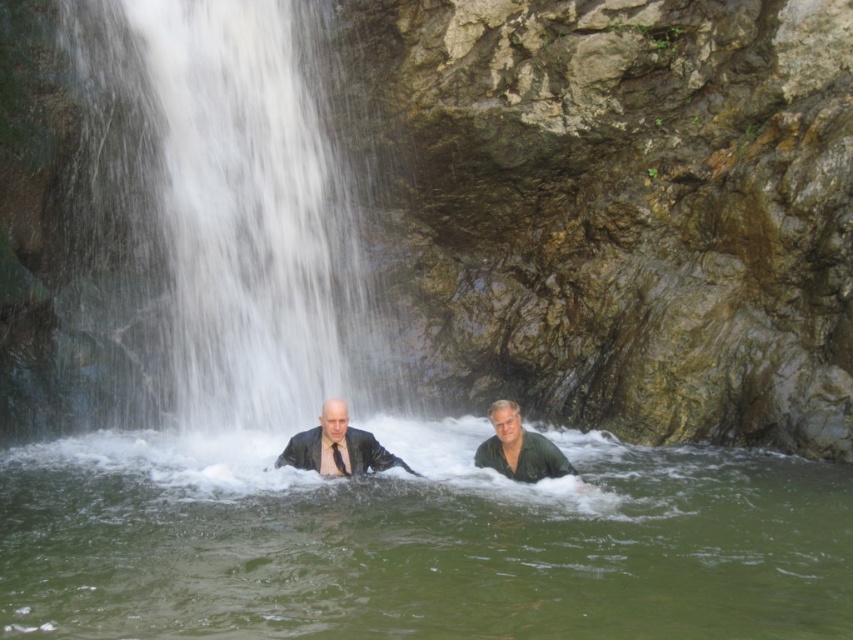
You are a photographer trying to capture the waterfall scene. You notice two specific points in the image at coordinates point (538, 493) and point (369, 324). Which point would appear larger in your photo?

Point (538, 493) is closer to the camera than point (369, 324), so it would appear larger in the photo.

You are a photographer trying to capture the waterfall in the image. You notice a point at coordinates (337,445) that marks a specific object. What object is located at that point?

The point at coordinates (337,445) indicates the matte black suit at center.

You are standing at the edge of the waterfall in the image. There is a point marked at coordinates (418,541). What is located at that point?

The point at (418,541) corresponds to green liquid water at center.